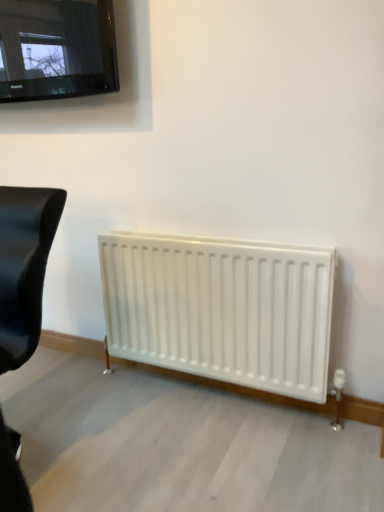
Question: Does black glossy television at upper left have a lesser width compared to black leather chair at left?

Choices:
 (A) yes
 (B) no

Answer: (A)

Question: Is black glossy television at upper left shorter than black leather chair at left?

Choices:
 (A) no
 (B) yes

Answer: (B)

Question: Is black leather chair at left at the back of black glossy television at upper left?

Choices:
 (A) yes
 (B) no

Answer: (B)

Question: Is the surface of black glossy television at upper left in direct contact with black leather chair at left?

Choices:
 (A) yes
 (B) no

Answer: (B)

Question: Is black glossy television at upper left to the left of black leather chair at left from the viewer's perspective?

Choices:
 (A) yes
 (B) no

Answer: (B)

Question: Can you confirm if black glossy television at upper left is wider than black leather chair at left?

Choices:
 (A) no
 (B) yes

Answer: (A)

Question: Are black leather chair at left and black glossy television at upper left far apart?

Choices:
 (A) no
 (B) yes

Answer: (B)

Question: Is black leather chair at left behind black glossy television at upper left?

Choices:
 (A) no
 (B) yes

Answer: (A)

Question: Does black leather chair at left have a larger size compared to black glossy television at upper left?

Choices:
 (A) yes
 (B) no

Answer: (A)

Question: From a real-world perspective, is black leather chair at left on black glossy television at upper left?

Choices:
 (A) yes
 (B) no

Answer: (B)

Question: From the image's perspective, is black leather chair at left on black glossy television at upper left?

Choices:
 (A) yes
 (B) no

Answer: (B)

Question: Is black glossy television at upper left inside black leather chair at left?

Choices:
 (A) no
 (B) yes

Answer: (A)

Question: Relative to black leather chair at left, is black glossy television at upper left in front or behind?

Choices:
 (A) behind
 (B) front

Answer: (A)